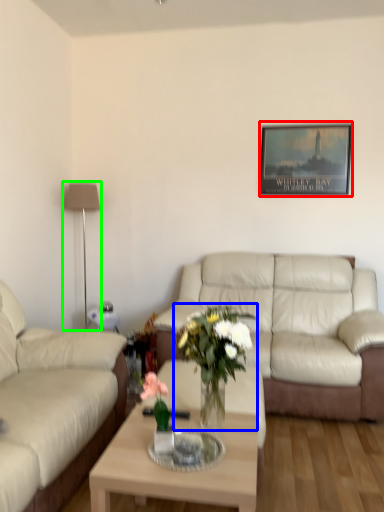
Question: Estimate the real-world distances between objects in this image. Which object is closer to picture frame (highlighted by a red box), houseplant (highlighted by a blue box) or lamp (highlighted by a green box)?

Choices:
 (A) houseplant
 (B) lamp

Answer: (B)